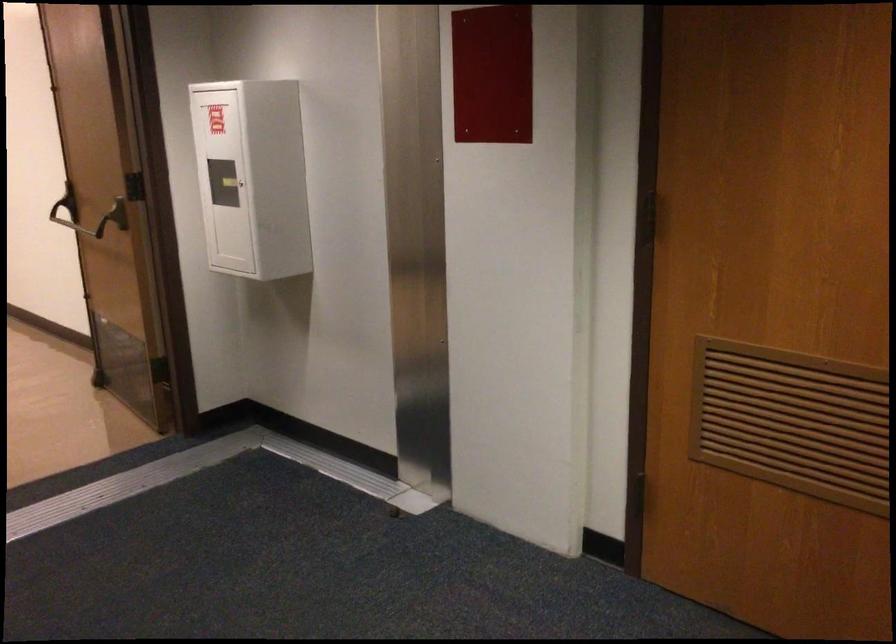
Describe the element at coordinates (65, 207) in the screenshot. I see `a black door handle` at that location.